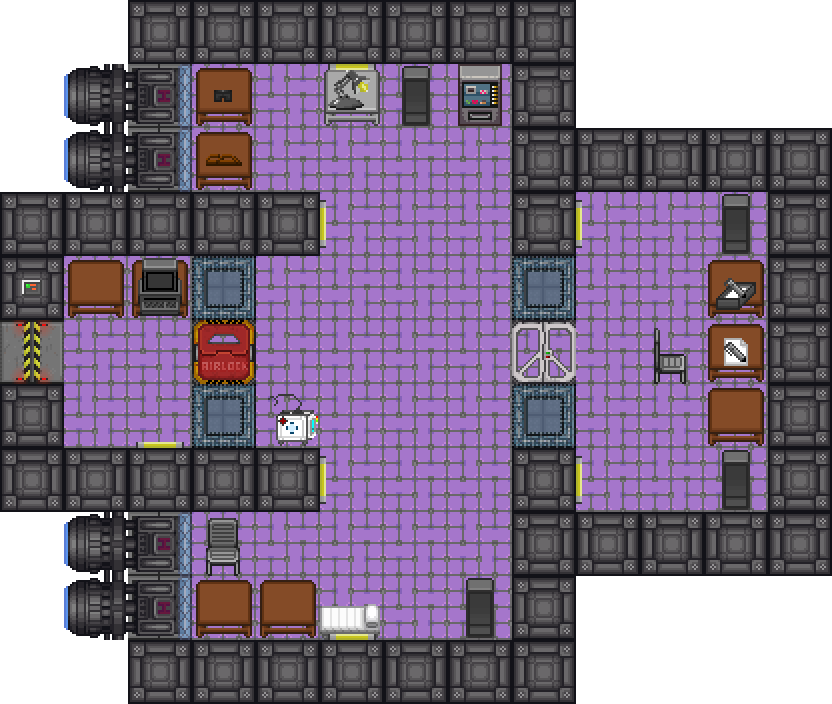
Where is `brown desks`? This screenshot has height=704, width=832. brown desks is located at coordinates (97, 289), (221, 601), (280, 603), (730, 400), (740, 341), (735, 265), (214, 151), (241, 92).